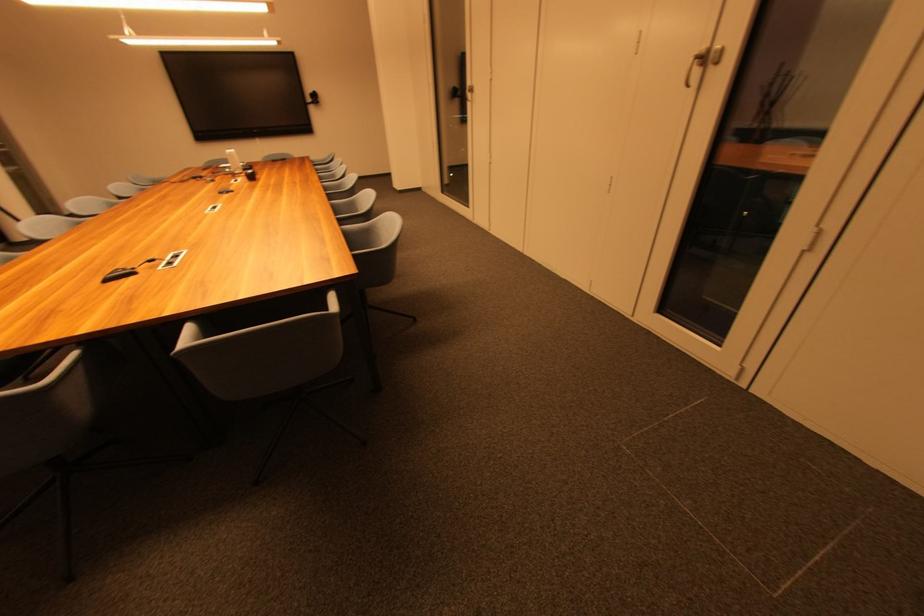
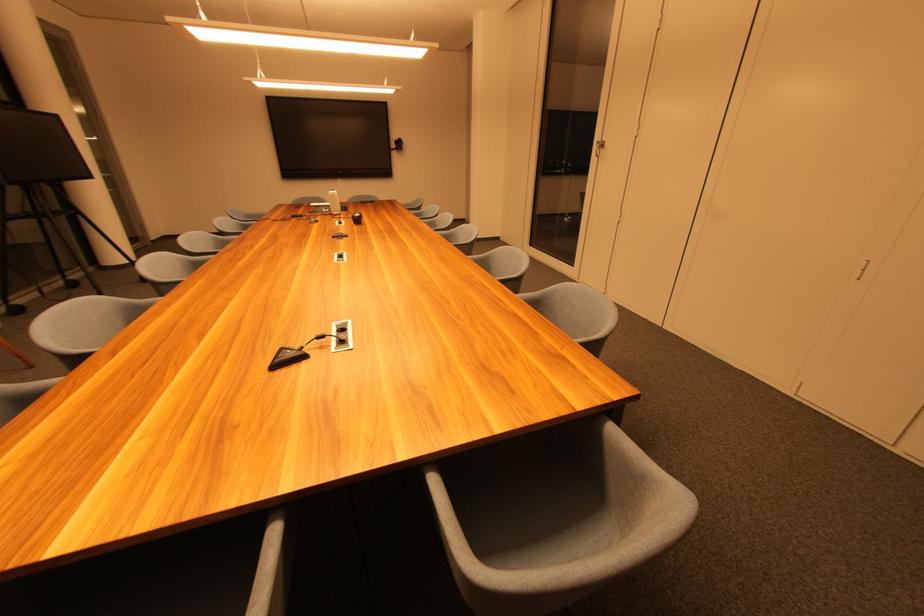
The point at (310, 131) is marked in the first image. Where is the corresponding point in the second image?

(391, 175)